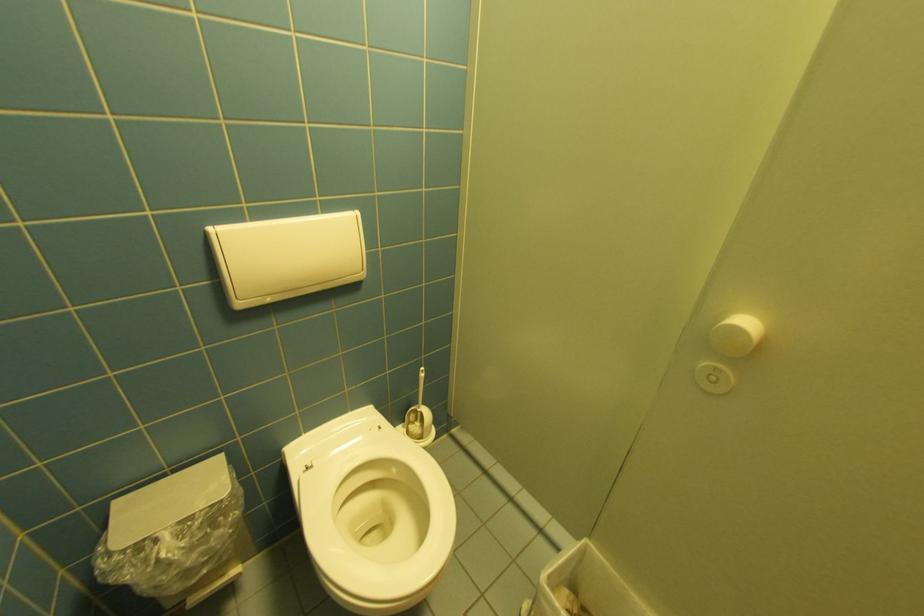
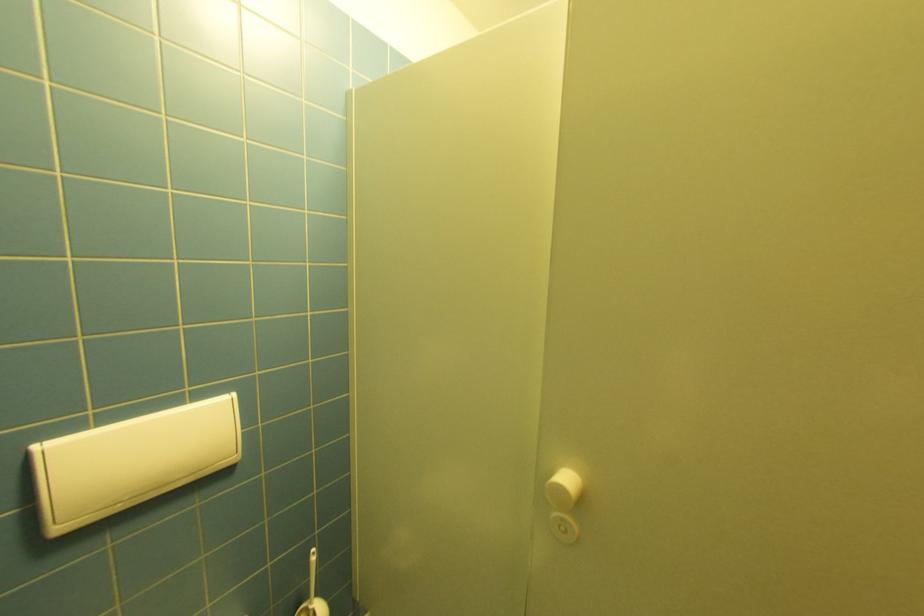
Where in the second image is the point corresponding to (245,305) from the first image?

(66, 530)